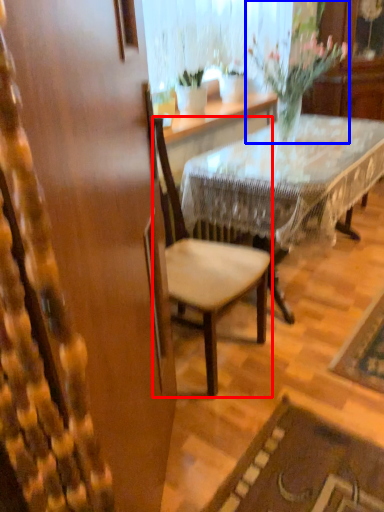
Question: Which object appears closest to the camera in this image, chair (highlighted by a red box) or houseplant (highlighted by a blue box)?

Choices:
 (A) chair
 (B) houseplant

Answer: (A)